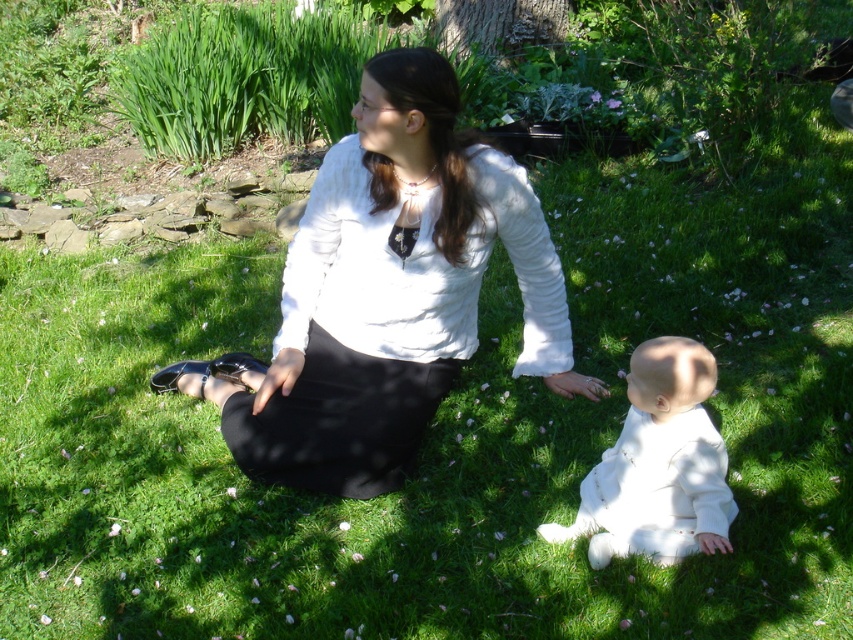
You are a photographer trying to capture a photo of the white soft fabric baby at lower right without including the white matte blouse at center in the frame. Is this possible based on their positions?

The white matte blouse at center is above the white soft fabric baby at lower right, so the blouse would likely block the view of the baby if positioned directly above. Adjust your angle or move closer to avoid the blouse obstructing the baby.

You are standing at the origin of the coordinate system in the image. You see a point at coordinates (387, 292). What object is located at that point?

The point at coordinates (387, 292) corresponds to the white matte blouse at center.

You are a photographer trying to capture the perfect shot of the white matte blouse at center. Based on the scene description, where should you position your camera to ensure the blouse is centered in the frame?

The white matte blouse at center is already positioned at the center of the image, as its 2D coordinates are at approximately point (387,292), which is near the center of the frame.